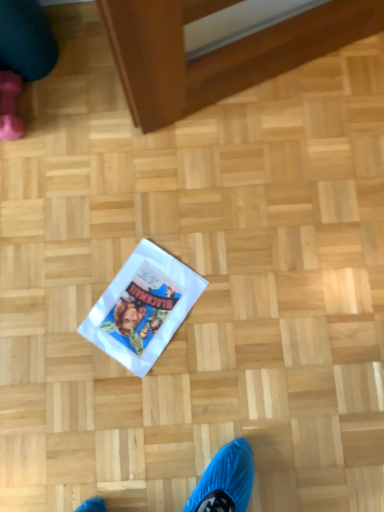
You are a GUI agent. You are given a task and a screenshot of the screen. Output one action in this format:
    pyautogui.click(x=<x>, y=<y>)
    Task: Click on the empty space that is to the right of pink rubber boot at upper left
    The height and width of the screenshot is (512, 384).
    Given the screenshot: What is the action you would take?
    pyautogui.click(x=75, y=110)